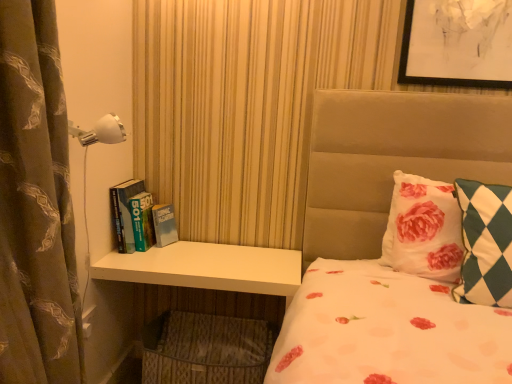
This screenshot has width=512, height=384. I want to click on free location to the right of green matte book at left, so click(x=187, y=258).